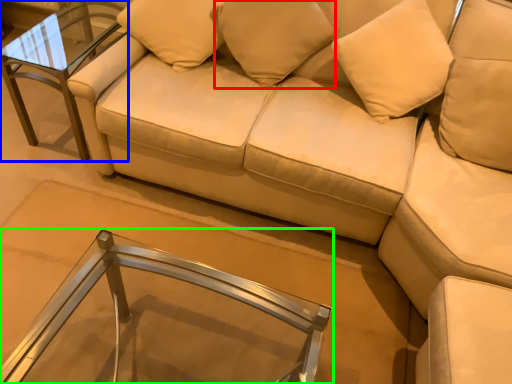
Question: Which is farther away from pillow (highlighted by a red box)? table (highlighted by a blue box) or table (highlighted by a green box)?

Choices:
 (A) table
 (B) table

Answer: (B)